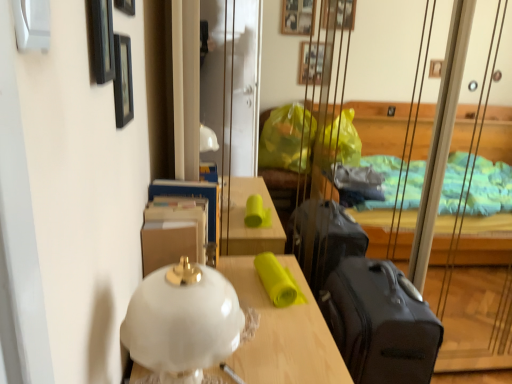
Question: From the image's perspective, does white matte lampshade at center appear lower than black smooth suitcase at right?

Choices:
 (A) no
 (B) yes

Answer: (B)

Question: Does white matte lampshade at center have a larger size compared to black smooth suitcase at right?

Choices:
 (A) no
 (B) yes

Answer: (B)

Question: Does white matte lampshade at center have a smaller size compared to black smooth suitcase at right?

Choices:
 (A) no
 (B) yes

Answer: (A)

Question: Does white matte lampshade at center lie behind black smooth suitcase at right?

Choices:
 (A) no
 (B) yes

Answer: (A)

Question: Can you confirm if white matte lampshade at center is wider than black smooth suitcase at right?

Choices:
 (A) no
 (B) yes

Answer: (B)

Question: Is black smooth suitcase at right bigger or smaller than black matte picture frame at upper left, positioned as the 3th picture frame in back-to-front order?

Choices:
 (A) big
 (B) small

Answer: (A)

Question: Is black smooth suitcase at right spatially inside black matte picture frame at upper left, which appears as the first picture frame when viewed from the front, or outside of it?

Choices:
 (A) inside
 (B) outside

Answer: (B)

Question: Is black smooth suitcase at right wider or thinner than black matte picture frame at upper left, which appears as the first picture frame when viewed from the front?

Choices:
 (A) wide
 (B) thin

Answer: (A)

Question: From the image's perspective, is black smooth suitcase at right located above or below black matte picture frame at upper left, positioned as the 3th picture frame in back-to-front order?

Choices:
 (A) below
 (B) above

Answer: (A)

Question: From a real-world perspective, relative to black matte picture frame at upper left, positioned as the third picture frame in front-to-back order, is black smooth suitcase at right vertically above or below?

Choices:
 (A) above
 (B) below

Answer: (B)

Question: In the image, is black smooth suitcase at right positioned in front of or behind black matte picture frame at upper left, positioned as the third picture frame in front-to-back order?

Choices:
 (A) behind
 (B) front

Answer: (A)

Question: In the image, is black smooth suitcase at right on the left side or the right side of black matte picture frame at upper left, which is counted as the first picture frame, starting from the back?

Choices:
 (A) right
 (B) left

Answer: (A)

Question: In terms of width, does black smooth suitcase at right look wider or thinner when compared to black matte picture frame at upper left, which is counted as the first picture frame, starting from the back?

Choices:
 (A) wide
 (B) thin

Answer: (A)

Question: Considering the positions of wooden picture frame at upper left, which is counted as the second picture frame, starting from the back, and black matte picture frame at upper left, positioned as the 3th picture frame in back-to-front order, in the image, is wooden picture frame at upper left, which is counted as the second picture frame, starting from the back, taller or shorter than black matte picture frame at upper left, positioned as the 3th picture frame in back-to-front order,?

Choices:
 (A) short
 (B) tall

Answer: (A)

Question: Considering the positions of wooden picture frame at upper left, which is the 2th picture frame from front to back, and black matte picture frame at upper left, positioned as the 3th picture frame in back-to-front order, in the image, is wooden picture frame at upper left, which is the 2th picture frame from front to back, bigger or smaller than black matte picture frame at upper left, positioned as the 3th picture frame in back-to-front order,?

Choices:
 (A) big
 (B) small

Answer: (B)